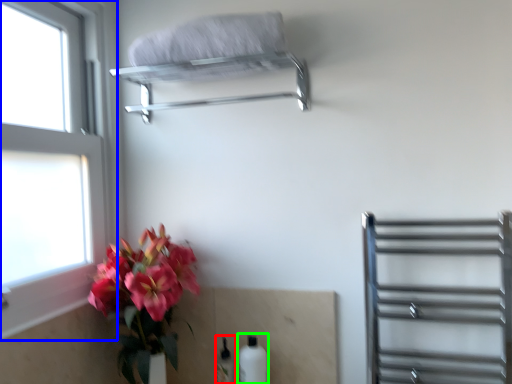
Question: Which object is the farthest from bottle (highlighted by a red box)? Choose among these: window (highlighted by a blue box) or bottle (highlighted by a green box).

Choices:
 (A) window
 (B) bottle

Answer: (A)